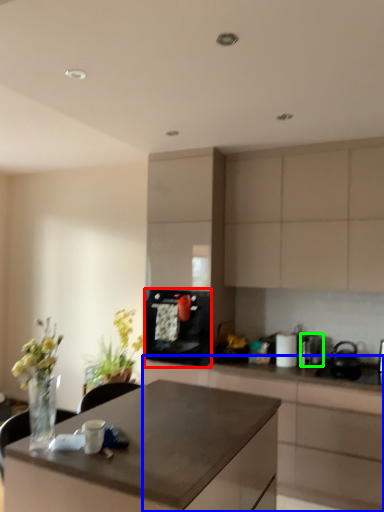
Question: Which object is positioned closest to kitchen appliance (highlighted by a red box)? Select from cabinetry (highlighted by a blue box) and appliance (highlighted by a green box).

Choices:
 (A) cabinetry
 (B) appliance

Answer: (A)